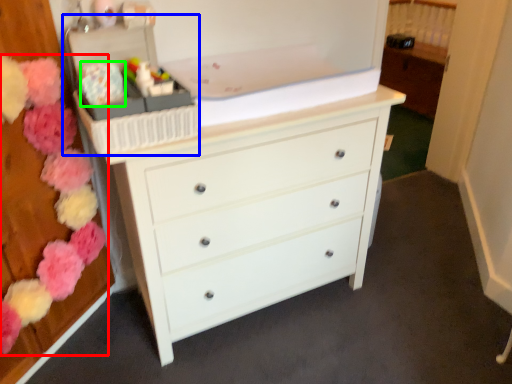
Question: Based on their relative distances, which object is farther from flower (highlighted by a red box)? Choose from storage box (highlighted by a blue box) and flower (highlighted by a green box).

Choices:
 (A) storage box
 (B) flower

Answer: (B)